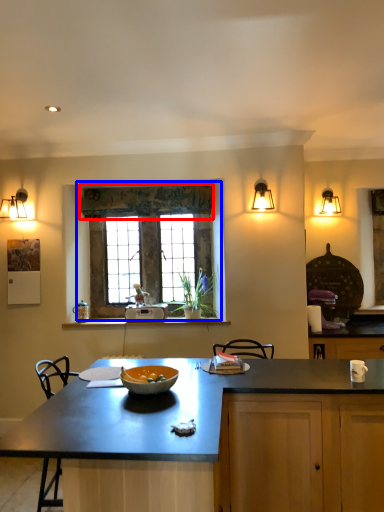
Question: Which of the following is the closest to the observer, curtain (highlighted by a red box) or window (highlighted by a blue box)?

Choices:
 (A) curtain
 (B) window

Answer: (A)